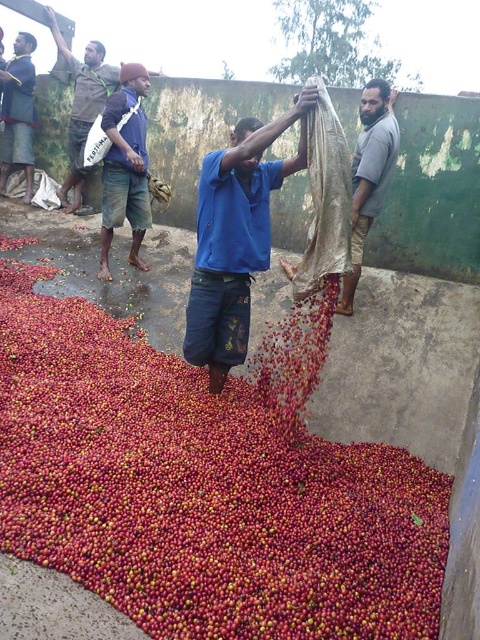
Can you confirm if red matte coffee beans at center is shorter than gray cotton shirt at upper right?

Yes, red matte coffee beans at center is shorter than gray cotton shirt at upper right.

Where is `red matte coffee beans at center`? red matte coffee beans at center is located at coordinates (200, 492).

I want to click on red matte coffee beans at center, so click(x=200, y=492).

Is red matte coffee beans at center above blue fabric bag at upper left?

No.

Between point (127, 337) and point (117, 104), which one is positioned in front?

Point (127, 337) is more forward.

The image size is (480, 640). In order to click on red matte coffee beans at center in this screenshot , I will do `click(200, 492)`.

Between blue fabric bag at upper left and brown cotton shirt at upper left, which one has less height?

Standing shorter between the two is blue fabric bag at upper left.

Does point (120, 211) come closer to viewer compared to point (73, 67)?

Yes.

Does point (120, 118) lie behind point (84, 132)?

No, (120, 118) is in front of (84, 132).

Locate an element on the screen. The height and width of the screenshot is (640, 480). blue fabric bag at upper left is located at coordinates [124, 168].